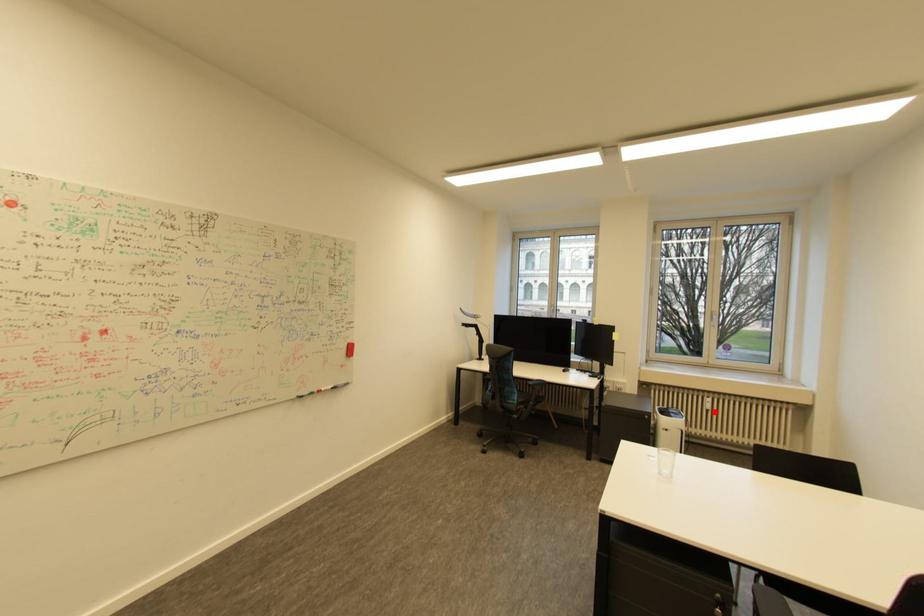
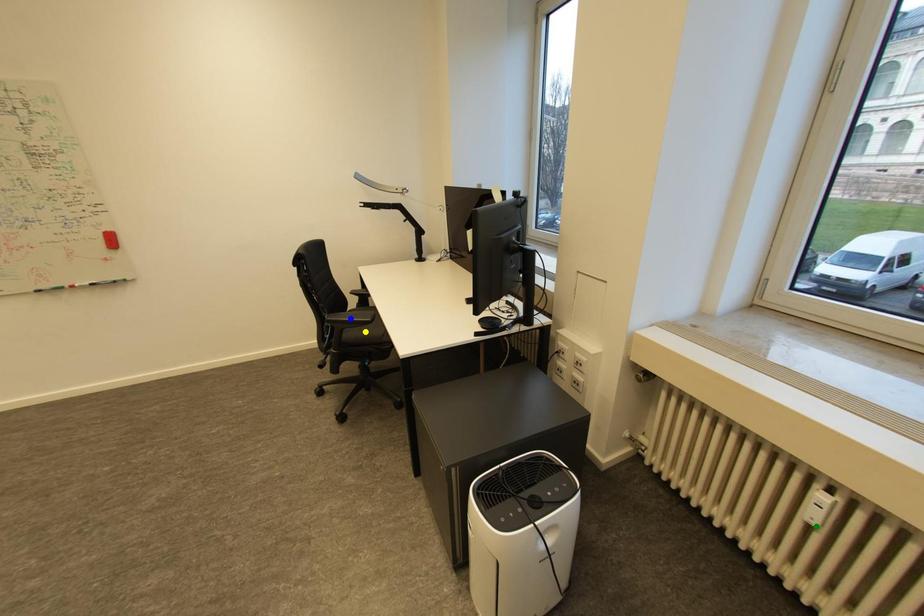
Question: I am providing you with two images of the same scene from different viewpoints. A red point is marked on the first image. You are given multiple points on the second image. Which point in image 2 is actually the same real-world point as the red point in image 1?

Choices:
 (A) blue point
 (B) green point
 (C) yellow point

Answer: (B)